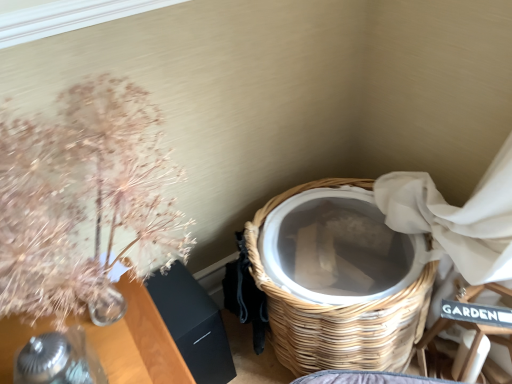
Question: From the image's perspective, is wooden armchair at lower right beneath woven wood basket at lower right?

Choices:
 (A) yes
 (B) no

Answer: (A)

Question: Does wooden armchair at lower right come behind woven wood basket at lower right?

Choices:
 (A) no
 (B) yes

Answer: (B)

Question: Does wooden armchair at lower right have a lesser height compared to woven wood basket at lower right?

Choices:
 (A) no
 (B) yes

Answer: (B)

Question: Is wooden armchair at lower right facing away from woven wood basket at lower right?

Choices:
 (A) no
 (B) yes

Answer: (A)

Question: Considering the relative sizes of wooden armchair at lower right and woven wood basket at lower right in the image provided, is wooden armchair at lower right bigger than woven wood basket at lower right?

Choices:
 (A) yes
 (B) no

Answer: (B)

Question: Considering the positions of wooden armchair at lower right and translucent glass vase with dried flowers at upper left in the image, is wooden armchair at lower right wider or thinner than translucent glass vase with dried flowers at upper left?

Choices:
 (A) thin
 (B) wide

Answer: (A)

Question: From the image's perspective, relative to translucent glass vase with dried flowers at upper left, is wooden armchair at lower right above or below?

Choices:
 (A) above
 (B) below

Answer: (B)

Question: In the image, is wooden armchair at lower right positioned in front of or behind translucent glass vase with dried flowers at upper left?

Choices:
 (A) front
 (B) behind

Answer: (B)

Question: From a real-world perspective, relative to translucent glass vase with dried flowers at upper left, is wooden armchair at lower right vertically above or below?

Choices:
 (A) above
 (B) below

Answer: (B)

Question: Is woven wood basket at lower right to the left or to the right of translucent glass vase with dried flowers at upper left in the image?

Choices:
 (A) right
 (B) left

Answer: (A)

Question: In terms of height, does woven wood basket at lower right look taller or shorter compared to translucent glass vase with dried flowers at upper left?

Choices:
 (A) tall
 (B) short

Answer: (A)

Question: From the image's perspective, is woven wood basket at lower right positioned above or below translucent glass vase with dried flowers at upper left?

Choices:
 (A) above
 (B) below

Answer: (B)

Question: In terms of width, does woven wood basket at lower right look wider or thinner when compared to translucent glass vase with dried flowers at upper left?

Choices:
 (A) thin
 (B) wide

Answer: (B)

Question: From a real-world perspective, is wooden armchair at lower right physically located above or below woven wood basket at lower right?

Choices:
 (A) above
 (B) below

Answer: (B)

Question: Considering their positions, is wooden armchair at lower right located in front of or behind woven wood basket at lower right?

Choices:
 (A) front
 (B) behind

Answer: (B)